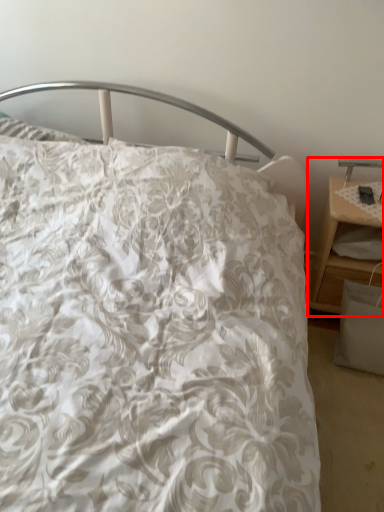
Question: From the image's perspective, where is nightstand (annotated by the red box) located in relation to table lamp in the image?

Choices:
 (A) above
 (B) below

Answer: (B)